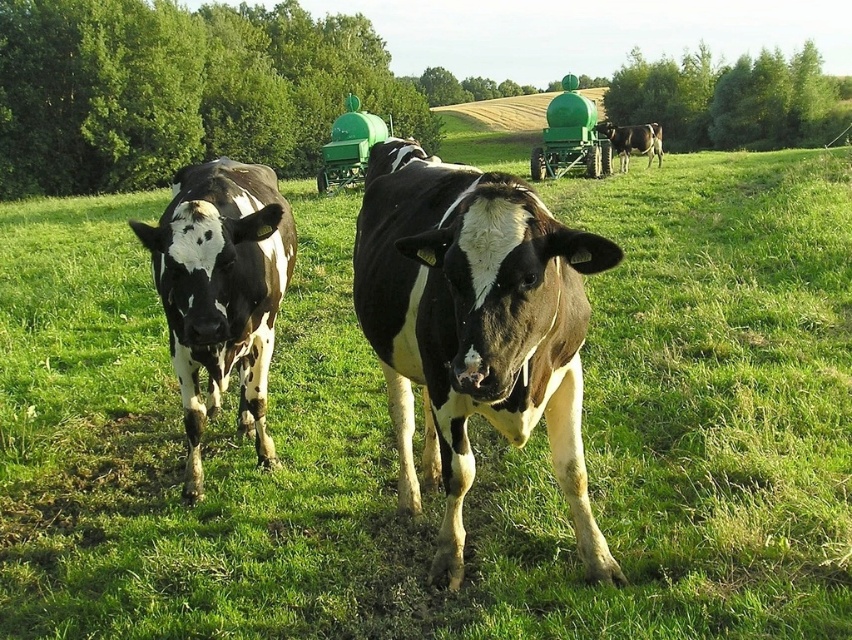
Is black and white cow at center closer to the viewer compared to black and white spotted cow at left?

Yes, it is in front of black and white spotted cow at left.

Can you confirm if black and white cow at center is positioned below black and white spotted cow at left?

Yes, black and white cow at center is below black and white spotted cow at left.

Between point (435, 442) and point (168, 304), which one is positioned behind?

Positioned behind is point (435, 442).

The width and height of the screenshot is (852, 640). I want to click on black and white cow at center, so click(x=475, y=326).

Who is higher up, black and white cow at center or black and white cow at upper right?

black and white cow at upper right

Where is `black and white cow at center`? This screenshot has width=852, height=640. black and white cow at center is located at coordinates (475, 326).

Who is more distant from viewer, (x=358, y=273) or (x=607, y=132)?

The point (x=607, y=132) is more distant.

Identify the location of black and white cow at center. The height and width of the screenshot is (640, 852). (475, 326).

Is black and white spotted cow at left to the left of black and white cow at upper right from the viewer's perspective?

Indeed, black and white spotted cow at left is positioned on the left side of black and white cow at upper right.

Does black and white spotted cow at left have a greater height compared to black and white cow at upper right?

Incorrect, black and white spotted cow at left's height is not larger of black and white cow at upper right's.

Is point (255, 216) farther from camera compared to point (626, 160)?

That is False.

The image size is (852, 640). I want to click on black and white spotted cow at left, so [222, 291].